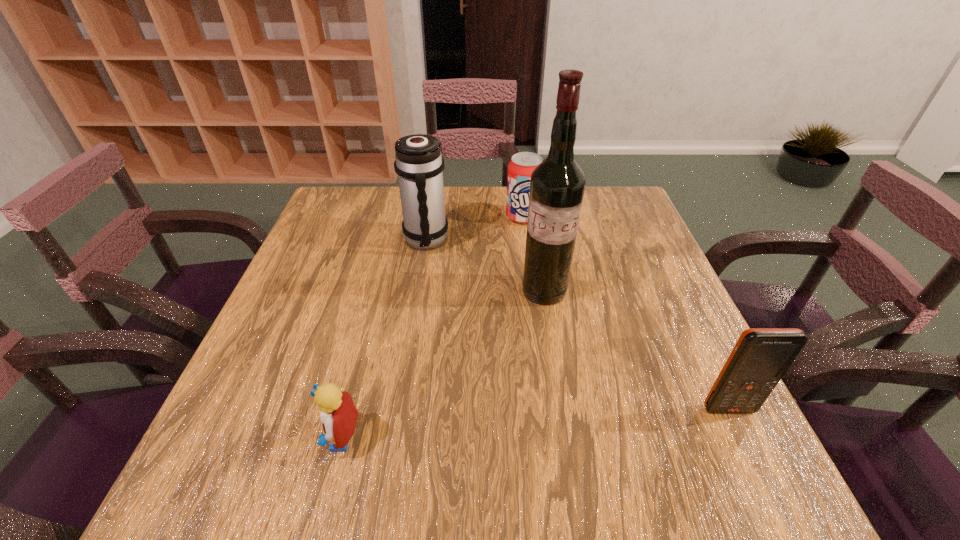
What are the coordinates of `soda can that is at the far edge` in the screenshot? It's located at (520, 168).

Identify the location of thermos bottle positioned at the far edge. (419, 165).

Locate an element on the screen. Lego at the near edge is located at coordinates (338, 414).

Locate an element on the screen. cellular telephone located in the near edge section of the desktop is located at coordinates (761, 356).

Find the location of `object situated at the right edge`. object situated at the right edge is located at coordinates (761, 356).

Find the location of `object that is at the near right corner`. object that is at the near right corner is located at coordinates (761, 356).

The width and height of the screenshot is (960, 540). Find the location of `vacant region at the far edge of the desktop`. vacant region at the far edge of the desktop is located at coordinates (454, 215).

Identify the location of free region at the near edge. (636, 435).

Locate an element on the screen. This screenshot has width=960, height=540. free space at the left edge of the desktop is located at coordinates [361, 258].

In the image, there is a desktop. At what (x,y) coordinates should I click in order to perform the action: click on vacant area at the right edge. Please return your answer as a coordinate pair (x, y). This screenshot has width=960, height=540. Looking at the image, I should click on pyautogui.click(x=670, y=289).